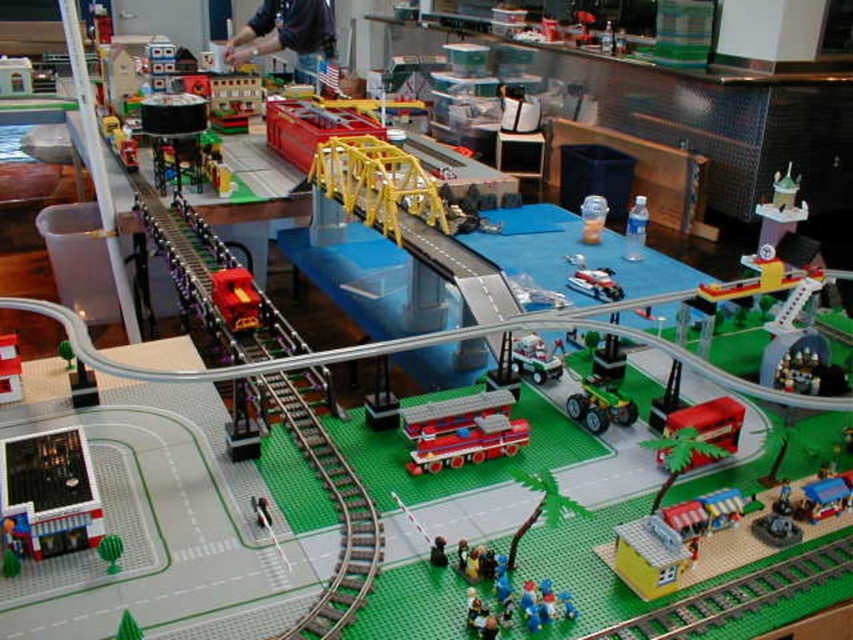
Question: Considering the real-world distances, which object is closest to the green matte tractor at center-right?

Choices:
 (A) white plastic truck at center
 (B) green matte cactus at lower left
 (C) white plastic boat at center

Answer: (A)

Question: Which of these objects is positioned farthest from the blue plastic train at lower right?

Choices:
 (A) white plastic truck at center
 (B) green matte cactus at lower left
 (C) green matte tractor at center-right

Answer: (B)

Question: Observing the image, what is the correct spatial positioning of shiny red firetruck at center in reference to green matte tractor at center-right?

Choices:
 (A) left
 (B) right

Answer: (A)

Question: Can you confirm if green matte tractor at center-right is wider than blue plastic train at lower right?

Choices:
 (A) yes
 (B) no

Answer: (A)

Question: In this image, where is metallic red bus at lower right located relative to white plastic boat at center?

Choices:
 (A) above
 (B) below

Answer: (B)

Question: Which point appears closest to the camera in this image?

Choices:
 (A) (622, 634)
 (B) (318, 44)
 (C) (425, 444)
 (D) (720, 428)

Answer: (A)